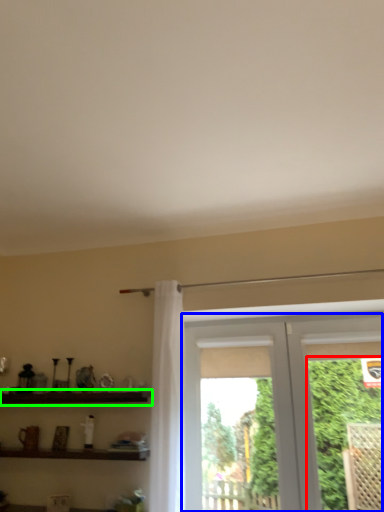
Question: Estimate the real-world distances between objects in this image. Which object is farther from plant (highlighted by a red box), window (highlighted by a blue box) or shelf (highlighted by a green box)?

Choices:
 (A) window
 (B) shelf

Answer: (B)